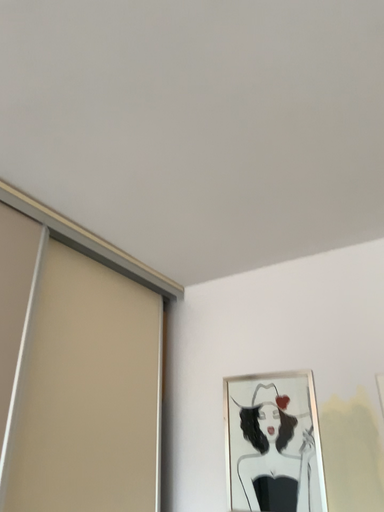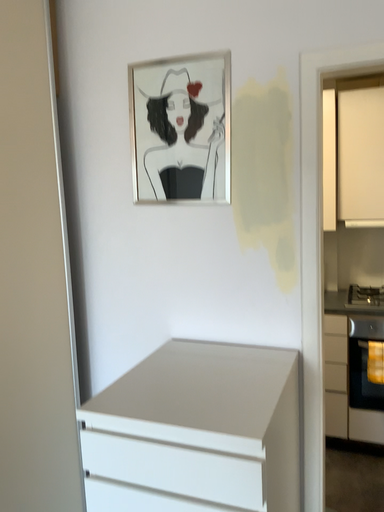
Question: How did the camera likely rotate when shooting the video?

Choices:
 (A) rotated upward
 (B) rotated downward

Answer: (B)